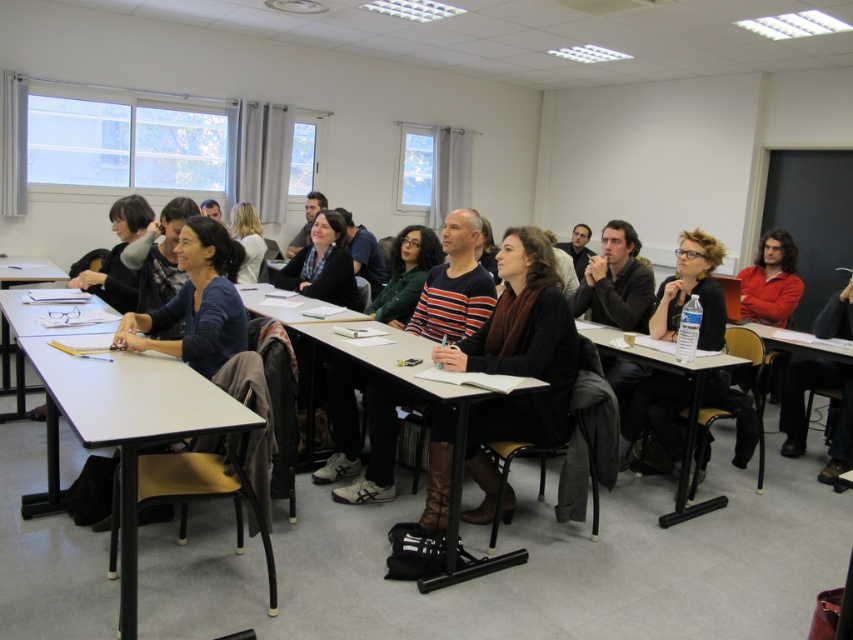
You are organizing a classroom layout and need to place a new whiteboard. The whiteboard is too large to fit on the wooden table at lower right. Can it fit on the white plastic table at center instead?

The white plastic table at center is positioned over the wooden table at lower right, which means it is larger in size. Therefore, the whiteboard can fit on the white plastic table at center.

You are sitting at the white plastic table at center and want to pass a note to someone at the wooden table at lower right. In which direction should you move to reach their table?

You should move to the right to reach the wooden table at lower right since the white plastic table at center is to the left of it.

You are a person who is 160 cm tall and you need to sit at one of the tables in the classroom. The white plastic table at center is higher than the wooden table at lower right. Which table would be more comfortable for you to use?

The wooden table at lower right would be more comfortable since it has a lower height, which is better suited for someone who is 160 cm tall.